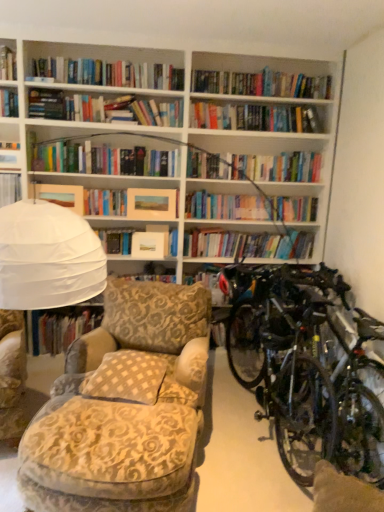
Image resolution: width=384 pixels, height=512 pixels. What do you see at coordinates (149, 245) in the screenshot?
I see `matte paper book at center, positioned as the 2th paperback book in right-to-left order` at bounding box center [149, 245].

What is the approximate width of matte yellow paper at upper left, arranged as the 3th paperback book when viewed from the right?

It is 2.62 inches.

The width and height of the screenshot is (384, 512). What do you see at coordinates (7, 63) in the screenshot? I see `hardcover book at upper left, which is the 1th book from front to back` at bounding box center [7, 63].

Measure the distance between beige textured pillow at center and camera.

7.29 feet.

Identify the location of matte paper book at center, marked as the second paperback book in a left-to-right arrangement. This screenshot has width=384, height=512. (149, 245).

Are matte paper picture frame at center, which is the 3th paperback book in left-to-right order, and beige textured pillow at center located far from each other?

Yes, matte paper picture frame at center, which is the 3th paperback book in left-to-right order, is far from beige textured pillow at center.

From the image's perspective, is matte paper picture frame at center, the 1th paperback book in the right-to-left sequence, located above beige textured pillow at center?

Indeed, from the image's perspective, matte paper picture frame at center, the 1th paperback book in the right-to-left sequence, is shown above beige textured pillow at center.

How different are the orientations of matte paper picture frame at center, which is the 3th paperback book in left-to-right order, and beige textured pillow at center in degrees?

matte paper picture frame at center, which is the 3th paperback book in left-to-right order, and beige textured pillow at center are facing 8.19 degrees away from each other.

From a real-world perspective, is matte paper picture frame at center, which is the 3th paperback book in left-to-right order, located higher than beige textured pillow at center?

Correct, in the physical world, matte paper picture frame at center, which is the 3th paperback book in left-to-right order, is higher than beige textured pillow at center.

From the picture: How many degrees apart are the facing directions of matte paper picture frame at center, the 1th paperback book in the right-to-left sequence, and matte yellow paper at upper left, which is the 1th paperback book from left to right?

9.1 degrees separate the facing orientations of matte paper picture frame at center, the 1th paperback book in the right-to-left sequence, and matte yellow paper at upper left, which is the 1th paperback book from left to right.

From a real-world perspective, does matte paper picture frame at center, which is the 3th paperback book in left-to-right order, sit lower than matte yellow paper at upper left, which is the 1th paperback book from left to right?

No, from a real-world perspective, matte paper picture frame at center, which is the 3th paperback book in left-to-right order, is not beneath matte yellow paper at upper left, which is the 1th paperback book from left to right.

Is matte paper picture frame at center, the 1th paperback book in the right-to-left sequence, oriented towards matte yellow paper at upper left, which is the 1th paperback book from left to right?

No, matte paper picture frame at center, the 1th paperback book in the right-to-left sequence, is not aimed at matte yellow paper at upper left, which is the 1th paperback book from left to right.

Which is correct: matte paper picture frame at center, the 1th paperback book in the right-to-left sequence, is inside matte yellow paper at upper left, which is the 1th paperback book from left to right, or outside of it?

matte paper picture frame at center, the 1th paperback book in the right-to-left sequence, lies outside matte yellow paper at upper left, which is the 1th paperback book from left to right.

Is hardcover book at upper left, the 2th book ordered from the bottom, surrounding matte yellow paper at upper left, which is the 1th paperback book from left to right?

That's incorrect, matte yellow paper at upper left, which is the 1th paperback book from left to right, is not inside hardcover book at upper left, the 2th book ordered from the bottom.

Can you confirm if hardcover book at upper left, which is the 1th book from front to back, is bigger than matte yellow paper at upper left, arranged as the 3th paperback book when viewed from the right?

Indeed, hardcover book at upper left, which is the 1th book from front to back, has a larger size compared to matte yellow paper at upper left, arranged as the 3th paperback book when viewed from the right.

Is hardcover book at upper left, which is counted as the 1th book, starting from the left, facing towards matte yellow paper at upper left, arranged as the 3th paperback book when viewed from the right?

No.

Based on the photo, from a real-world perspective, is hardcover book at upper left, arranged as the second book when viewed from the back, physically located above or below matte yellow paper at upper left, arranged as the 3th paperback book when viewed from the right?

Clearly, from a real-world perspective, hardcover book at upper left, arranged as the second book when viewed from the back, is above matte yellow paper at upper left, arranged as the 3th paperback book when viewed from the right.

Which object is wider, hardcover book at upper left, the 2th book ordered from the bottom, or beige textured pillow at center?

With larger width is beige textured pillow at center.

Measure the distance from hardcover book at upper left, the 2th book when ordered from right to left, to beige textured pillow at center.

A distance of 2.33 meters exists between hardcover book at upper left, the 2th book when ordered from right to left, and beige textured pillow at center.

Does hardcover book at upper left, which appears as the first book when viewed from the top, turn towards beige textured pillow at center?

No, hardcover book at upper left, which appears as the first book when viewed from the top, is not facing towards beige textured pillow at center.

Is beige textured pillow at center located within hardcover book at upper left, the 2th book when ordered from right to left?

No, hardcover book at upper left, the 2th book when ordered from right to left, does not contain beige textured pillow at center.

From the image's perspective, is hardcover book at center, the 1th book positioned from the back, located above or below hardcover book at upper left, arranged as the second book when viewed from the back?

hardcover book at center, the 1th book positioned from the back, is below hardcover book at upper left, arranged as the second book when viewed from the back.

Is hardcover book at center, acting as the second book starting from the front, in front of or behind hardcover book at upper left, the 2th book ordered from the bottom, in the image?

Clearly, hardcover book at center, acting as the second book starting from the front, is behind hardcover book at upper left, the 2th book ordered from the bottom.

Is point (102, 317) behind point (12, 52)?

No, it is not.

Does hardcover book at center, acting as the first book starting from the right, turn towards hardcover book at upper left, which appears as the first book when viewed from the top?

No, hardcover book at center, acting as the first book starting from the right, does not turn towards hardcover book at upper left, which appears as the first book when viewed from the top.

Which object is closer to the camera, matte paper picture frame at center, the 1th paperback book in the right-to-left sequence, or hardcover book at center, acting as the first book starting from the right?

Positioned in front is matte paper picture frame at center, the 1th paperback book in the right-to-left sequence.

Is matte paper picture frame at center, the 1th paperback book in the right-to-left sequence, taller or shorter than hardcover book at center, the 1th book positioned from the back?

Considering their sizes, matte paper picture frame at center, the 1th paperback book in the right-to-left sequence, has less height than hardcover book at center, the 1th book positioned from the back.

This screenshot has width=384, height=512. In the image, there is a matte paper picture frame at center, which is the 3th paperback book in left-to-right order. Identify the location of book below it (from the image's perspective). (60, 328).

Can you confirm if beige textured pillow at center is bigger than shiny metallic bicycles at right?

Actually, beige textured pillow at center might be smaller than shiny metallic bicycles at right.

I want to click on pillow below the shiny metallic bicycles at right (from a real-world perspective), so click(126, 378).

How many degrees apart are the facing directions of beige textured pillow at center and shiny metallic bicycles at right?

The angle between the facing direction of beige textured pillow at center and the facing direction of shiny metallic bicycles at right is 81.2 degrees.

From a real-world perspective, is beige textured pillow at center above or below shiny metallic bicycles at right?

Clearly, from a real-world perspective, beige textured pillow at center is below shiny metallic bicycles at right.

From a real-world perspective, which paperback book is the 3rd one above the beige textured pillow at center? Please provide its 2D coordinates.

[(151, 204)]

At what (x,y) coordinates should I click in order to perform the action: click on paperback book above the matte paper picture frame at center, which is the 3th paperback book in left-to-right order (from the image's perspective). Please return your answer as a coordinate pair (x, y). Looking at the image, I should click on (61, 195).

Estimate the real-world distances between objects in this image. Which object is closer to shiny metallic bicycles at right, matte paper picture frame at center, which is the 3th paperback book in left-to-right order, or beige textured pillow at center?

The object closer to shiny metallic bicycles at right is beige textured pillow at center.

When comparing their distances from matte yellow paper at upper left, arranged as the 3th paperback book when viewed from the right, does shiny metallic bicycles at right or hardcover book at upper left, arranged as the second book when viewed from the back, seem closer?

hardcover book at upper left, arranged as the second book when viewed from the back, is closer to matte yellow paper at upper left, arranged as the 3th paperback book when viewed from the right.

Looking at the image, which one is located further to hardcover book at center, the 1th book positioned from the bottom, matte paper book at center, positioned as the 2th paperback book in right-to-left order, or shiny metallic bicycles at right?

shiny metallic bicycles at right lies further to hardcover book at center, the 1th book positioned from the bottom, than the other object.

When comparing their distances from matte paper book at center, marked as the second paperback book in a left-to-right arrangement, does hardcover book at upper left, which appears as the first book when viewed from the top, or beige textured pillow at center seem further?

hardcover book at upper left, which appears as the first book when viewed from the top, lies further to matte paper book at center, marked as the second paperback book in a left-to-right arrangement, than the other object.

Based on their spatial positions, is hardcover book at center, acting as the second book starting from the front, or shiny metallic bicycles at right closer to matte paper picture frame at center, the 1th paperback book in the right-to-left sequence?

hardcover book at center, acting as the second book starting from the front, is positioned closer to the anchor matte paper picture frame at center, the 1th paperback book in the right-to-left sequence.

Which object lies nearer to the anchor point matte paper book at center, marked as the second paperback book in a left-to-right arrangement, matte paper picture frame at center, which is the 3th paperback book in left-to-right order, or matte yellow paper at upper left, arranged as the 3th paperback book when viewed from the right?

Among the two, matte paper picture frame at center, which is the 3th paperback book in left-to-right order, is located nearer to matte paper book at center, marked as the second paperback book in a left-to-right arrangement.

From the image, which object appears to be nearer to matte yellow paper at upper left, which is the 1th paperback book from left to right, hardcover book at upper left, which appears as the first book when viewed from the top, or shiny metallic bicycles at right?

hardcover book at upper left, which appears as the first book when viewed from the top, lies closer to matte yellow paper at upper left, which is the 1th paperback book from left to right, than the other object.

From the image, which object appears to be nearer to shiny metallic bicycles at right, hardcover book at center, which is counted as the second book, starting from the left, or matte paper picture frame at center, the 1th paperback book in the right-to-left sequence?

The object closer to shiny metallic bicycles at right is matte paper picture frame at center, the 1th paperback book in the right-to-left sequence.

Where is `book between hardcover book at upper left, the 2th book ordered from the bottom, and beige textured pillow at center vertically`? The width and height of the screenshot is (384, 512). book between hardcover book at upper left, the 2th book ordered from the bottom, and beige textured pillow at center vertically is located at coordinates (60, 328).

Locate an element on the screen. bicycle that lies between hardcover book at upper left, the 2th book when ordered from right to left, and beige textured pillow at center from top to bottom is located at coordinates 304,368.

Identify the location of pillow located between matte yellow paper at upper left, which is the 1th paperback book from left to right, and shiny metallic bicycles at right in the left-right direction. (126, 378).

Identify the location of book between hardcover book at upper left, the 2th book when ordered from right to left, and shiny metallic bicycles at right, in the vertical direction. This screenshot has width=384, height=512. (60, 328).